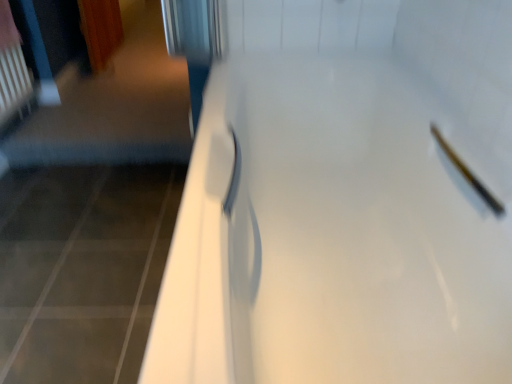
Find the location of a particular element. white glossy door at center is located at coordinates (342, 195).

What is the approximate height of white glossy door at center?

The height of white glossy door at center is 51.55 centimeters.

The width and height of the screenshot is (512, 384). What do you see at coordinates (342, 195) in the screenshot? I see `white glossy door at center` at bounding box center [342, 195].

Image resolution: width=512 pixels, height=384 pixels. Find the location of `matte white showerhead at upper right`. matte white showerhead at upper right is located at coordinates (467, 173).

What do you see at coordinates (467, 173) in the screenshot?
I see `matte white showerhead at upper right` at bounding box center [467, 173].

Measure the distance between matte white showerhead at upper right and camera.

matte white showerhead at upper right is 35.20 inches away from camera.

Find the location of a particular element. white glossy door at center is located at coordinates coord(342,195).

Considering the positions of objects white glossy door at center and matte white showerhead at upper right in the image provided, who is more to the right, white glossy door at center or matte white showerhead at upper right?

matte white showerhead at upper right is more to the right.

Which is behind, white glossy door at center or matte white showerhead at upper right?

matte white showerhead at upper right is further from the camera.

Does point (404, 45) lie behind point (472, 184)?

Yes, it is.

From the image's perspective, which is above, white glossy door at center or matte white showerhead at upper right?

From the image's view, matte white showerhead at upper right is above.

From a real-world perspective, is white glossy door at center on matte white showerhead at upper right?

No, from a real-world perspective, white glossy door at center is not over matte white showerhead at upper right

Is white glossy door at center thinner than matte white showerhead at upper right?

No.

Between white glossy door at center and matte white showerhead at upper right, which one has less height?

With less height is matte white showerhead at upper right.

Consider the image. Is white glossy door at center bigger than matte white showerhead at upper right?

Indeed, white glossy door at center has a larger size compared to matte white showerhead at upper right.

Is matte white showerhead at upper right inside white glossy door at center?

Yes.

Is white glossy door at center placed right next to matte white showerhead at upper right?

No, white glossy door at center is not in contact with matte white showerhead at upper right.

Is matte white showerhead at upper right at the back of white glossy door at center?

That's right, white glossy door at center is facing away from matte white showerhead at upper right.

How different are the orientations of white glossy door at center and matte white showerhead at upper right in degrees?

The angle between the facing direction of white glossy door at center and the facing direction of matte white showerhead at upper right is 0.00417 degrees.

Where is `shower behind the white glossy door at center`? shower behind the white glossy door at center is located at coordinates (467, 173).

Between matte white showerhead at upper right and white glossy door at center, which one appears on the right side from the viewer's perspective?

From the viewer's perspective, matte white showerhead at upper right appears more on the right side.

Considering the relative positions of matte white showerhead at upper right and white glossy door at center in the image provided, is matte white showerhead at upper right behind white glossy door at center?

Yes, it is behind white glossy door at center.

Does point (473, 177) appear closer or farther from the camera than point (301, 69)?

Point (473, 177) appears to be closer to the viewer than point (301, 69).

From the image's perspective, is matte white showerhead at upper right positioned above or below white glossy door at center?

Clearly, from the image's perspective, matte white showerhead at upper right is above white glossy door at center.

From a real-world perspective, is matte white showerhead at upper right beneath white glossy door at center?

Incorrect, from a real-world perspective, matte white showerhead at upper right is higher than white glossy door at center.

Between matte white showerhead at upper right and white glossy door at center, which one has larger width?

Wider between the two is white glossy door at center.

Considering the sizes of objects matte white showerhead at upper right and white glossy door at center in the image provided, who is shorter, matte white showerhead at upper right or white glossy door at center?

matte white showerhead at upper right is shorter.

Between matte white showerhead at upper right and white glossy door at center, which one has larger size?

white glossy door at center is bigger.

Is white glossy door at center inside matte white showerhead at upper right?

No, white glossy door at center is not a part of matte white showerhead at upper right.

Is matte white showerhead at upper right not close to white glossy door at center?

No, matte white showerhead at upper right is not far away from white glossy door at center.

Could you tell me if matte white showerhead at upper right is facing white glossy door at center?

Yes, matte white showerhead at upper right faces towards white glossy door at center.

Can you tell me how much matte white showerhead at upper right and white glossy door at center differ in facing direction?

matte white showerhead at upper right and white glossy door at center are facing 0.00417 degrees away from each other.

The width and height of the screenshot is (512, 384). I want to click on door that is in front of the matte white showerhead at upper right, so click(x=342, y=195).

The height and width of the screenshot is (384, 512). I want to click on door that is below the matte white showerhead at upper right (from the image's perspective), so click(342, 195).

Locate an element on the screen. The height and width of the screenshot is (384, 512). door on the left of matte white showerhead at upper right is located at coordinates (342, 195).